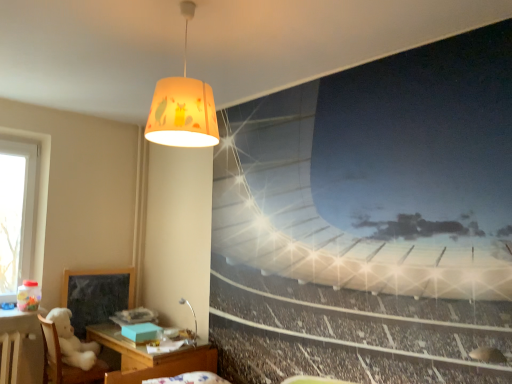
Question: Does dark gray matte bulletin board at lower left have a smaller size compared to matte yellow fabric lampshade at upper center, which appears as the first lamp when viewed from the top?

Choices:
 (A) no
 (B) yes

Answer: (B)

Question: Could you tell me if dark gray matte bulletin board at lower left is facing matte yellow fabric lampshade at upper center, the second lamp positioned from the back?

Choices:
 (A) no
 (B) yes

Answer: (B)

Question: Is dark gray matte bulletin board at lower left turned away from matte yellow fabric lampshade at upper center, which is counted as the first lamp, starting from the front?

Choices:
 (A) no
 (B) yes

Answer: (A)

Question: Are dark gray matte bulletin board at lower left and matte yellow fabric lampshade at upper center, which is counted as the 2th lamp, starting from the bottom, far apart?

Choices:
 (A) no
 (B) yes

Answer: (B)

Question: Can you confirm if dark gray matte bulletin board at lower left is bigger than matte yellow fabric lampshade at upper center, which is counted as the 2th lamp, starting from the bottom?

Choices:
 (A) no
 (B) yes

Answer: (A)

Question: Considering the relative sizes of dark gray matte bulletin board at lower left and matte yellow fabric lampshade at upper center, the second lamp positioned from the back, in the image provided, is dark gray matte bulletin board at lower left shorter than matte yellow fabric lampshade at upper center, the second lamp positioned from the back,?

Choices:
 (A) yes
 (B) no

Answer: (B)

Question: Can you confirm if dark gray matte bulletin board at lower left is shorter than metallic silver desk lamp at lower center, arranged as the 1th lamp when ordered from the bottom?

Choices:
 (A) no
 (B) yes

Answer: (A)

Question: Is metallic silver desk lamp at lower center, which is the 1th lamp in back-to-front order, at the back of dark gray matte bulletin board at lower left?

Choices:
 (A) no
 (B) yes

Answer: (A)

Question: Is dark gray matte bulletin board at lower left next to metallic silver desk lamp at lower center, which is the second lamp from top to bottom?

Choices:
 (A) no
 (B) yes

Answer: (A)

Question: Considering the relative sizes of dark gray matte bulletin board at lower left and metallic silver desk lamp at lower center, which is the 1th lamp in back-to-front order, in the image provided, is dark gray matte bulletin board at lower left wider than metallic silver desk lamp at lower center, which is the 1th lamp in back-to-front order,?

Choices:
 (A) no
 (B) yes

Answer: (A)

Question: Is dark gray matte bulletin board at lower left bigger than metallic silver desk lamp at lower center, arranged as the 1th lamp when ordered from the bottom?

Choices:
 (A) yes
 (B) no

Answer: (A)

Question: Is dark gray matte bulletin board at lower left oriented towards metallic silver desk lamp at lower center, which is the second lamp from top to bottom?

Choices:
 (A) no
 (B) yes

Answer: (B)

Question: Can you confirm if metallic silver desk lamp at lower center, which is the second lamp from top to bottom, is wider than white plush bear at lower left?

Choices:
 (A) no
 (B) yes

Answer: (A)